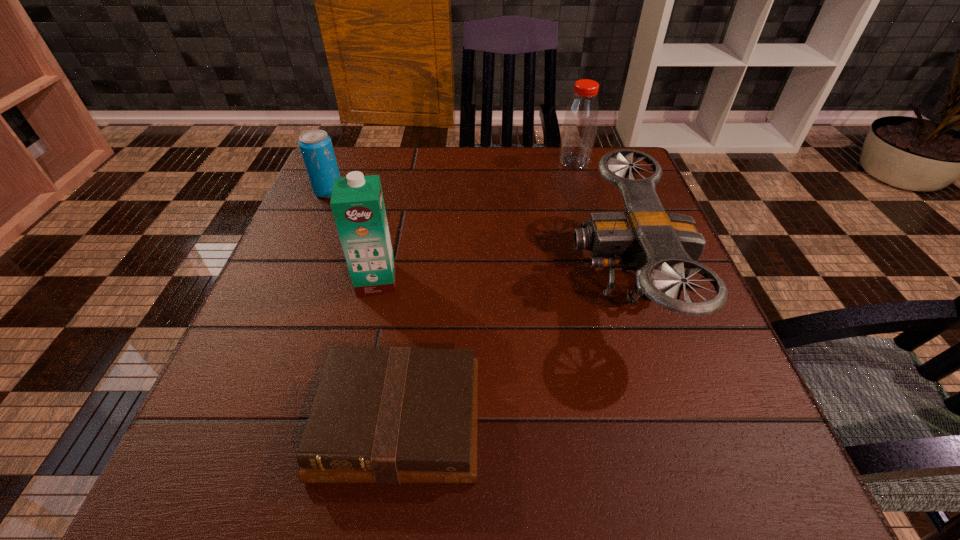
Where is `vacant area at the far edge`? Image resolution: width=960 pixels, height=540 pixels. vacant area at the far edge is located at coordinates (543, 192).

Where is `free space at the left edge of the desktop`? The image size is (960, 540). free space at the left edge of the desktop is located at coordinates (254, 397).

Locate an element on the screen. vacant area at the right edge is located at coordinates (603, 203).

In the image, there is a desktop. Where is `vacant space at the near left corner`? This screenshot has width=960, height=540. vacant space at the near left corner is located at coordinates (201, 446).

Image resolution: width=960 pixels, height=540 pixels. I want to click on free space at the far right corner of the desktop, so click(611, 191).

What are the coordinates of `free spot between the bottle and the shortest object` in the screenshot? It's located at (487, 291).

This screenshot has width=960, height=540. In order to click on blank region between the farthest object and the carton in this screenshot , I will do `click(475, 221)`.

Where is `vacant area that lies between the third tallest object and the Bible`? vacant area that lies between the third tallest object and the Bible is located at coordinates (511, 350).

You are a GUI agent. You are given a task and a screenshot of the screen. Output one action in this format:
    pyautogui.click(x=<x>, y=<y>)
    Task: Click on the vacant point located between the third shortest object and the carton
    The height and width of the screenshot is (540, 960).
    Given the screenshot: What is the action you would take?
    pyautogui.click(x=500, y=279)

Image resolution: width=960 pixels, height=540 pixels. I want to click on free spot between the shortest object and the fourth nearest object, so click(364, 306).